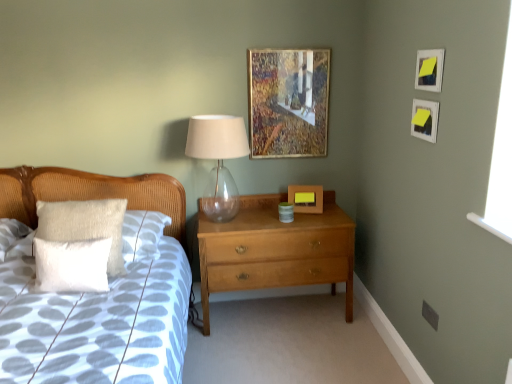
Image resolution: width=512 pixels, height=384 pixels. What are the coordinates of `free space underneath light brown wood chest of drawers at center (from a real-world perspective)` in the screenshot? It's located at (275, 310).